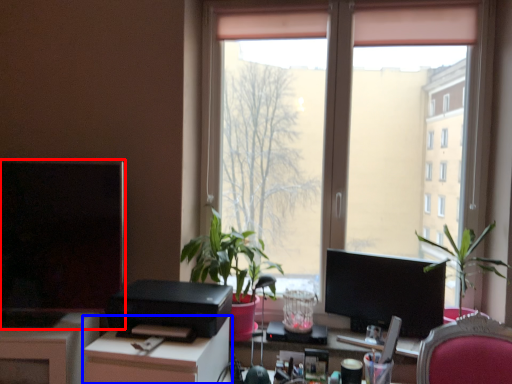
Question: Which object is further to the camera taking this photo, computer monitor (highlighted by a red box) or desk (highlighted by a blue box)?

Choices:
 (A) computer monitor
 (B) desk

Answer: (A)